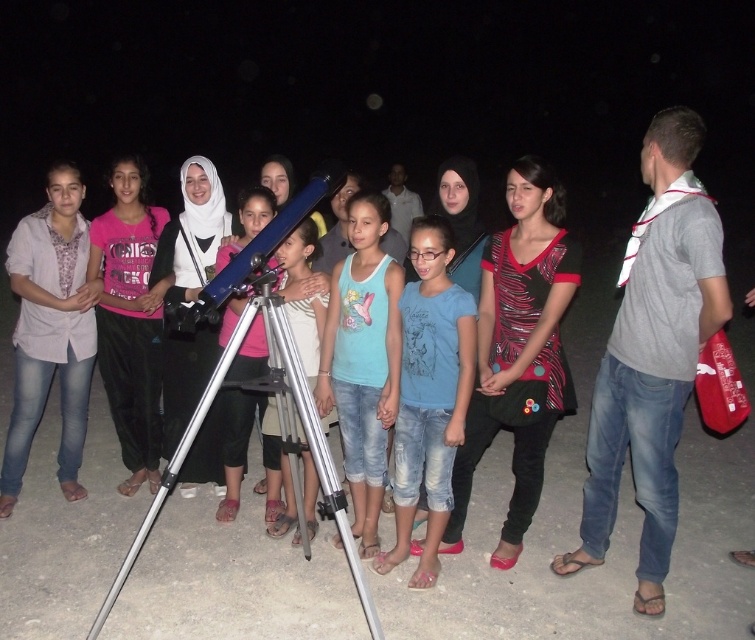
Consider the image. You are standing at the telescope and want to walk to the point marked as point (322,326). However, there is an obstacle at point (364,552). Will you encounter this obstacle on your way?

Yes, you will encounter the obstacle at point (364,552) because it is in front of point (322,326), meaning the obstacle is along the path to the destination.

From the picture: You are a photographer trying to capture a photo of the matte gray shirt at left and the metallic silver telescope at center. You need both subjects to be in focus. Your camera has a depth of field that can cover 1.5 meters. Can you take the photo without moving either subject?

The matte gray shirt at left and metallic silver telescope at center are 1.35 meters apart. Since the distance between them is within the camera depth of field of 1.5 meters, you can take the photo without moving either subject.

You are a photographer at this nighttime event. You want to take a photo that includes both the matte gray shirt at left and the metallic silver telescope at center. Which object should you focus on first if you want to ensure both are in sharp focus?

The matte gray shirt at left is located above the metallic silver telescope at center. To ensure both are in sharp focus, you should focus on the metallic silver telescope at center first because it is closer to the camera, and depth of field typically extends further behind the point of focus than in front.